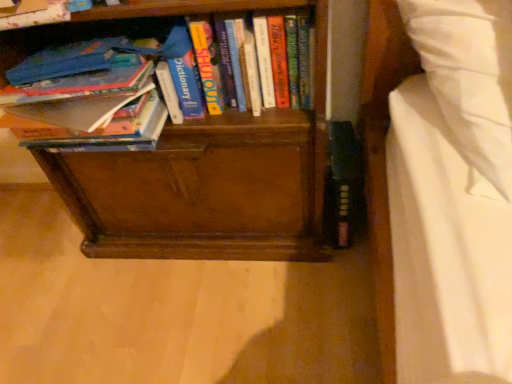
Question: Looking at their shapes, would you say hardcover book at upper left, which ranks as the 3th book in right-to-left order, is wider or thinner than hardcover book at center, arranged as the 1th book when viewed from the right?

Choices:
 (A) wide
 (B) thin

Answer: (A)

Question: Is hardcover book at upper left, which ranks as the 3th book in right-to-left order, in front of or behind hardcover book at center, arranged as the 1th book when viewed from the right, in the image?

Choices:
 (A) behind
 (B) front

Answer: (B)

Question: Which object is the closest to the brown wood bookcase at center?

Choices:
 (A) hardcover book at upper left, the 1th book from the left
 (B) hardcover book at center, placed as the third book when sorted from left to right
 (C) hardcover book at left, which appears as the 2th book when viewed from the right

Answer: (C)

Question: Considering the real-world distances, which object is farthest from the hardcover book at left, which appears as the 2th book when viewed from the right?

Choices:
 (A) brown wood bookcase at center
 (B) hardcover book at upper left, which ranks as the 3th book in right-to-left order
 (C) hardcover book at center, arranged as the 1th book when viewed from the right

Answer: (C)